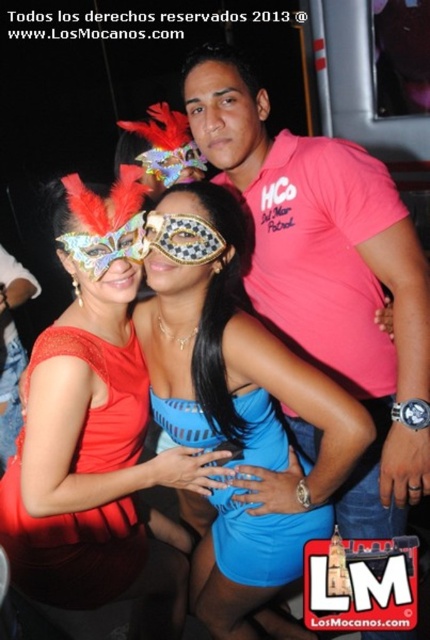
Question: Which of these objects is positioned closest to the blue jersey at center?

Choices:
 (A) shiny blue dress at center
 (B) red satin dress at center

Answer: (A)

Question: Is blue satin dress at center behind red satin dress at center?

Choices:
 (A) no
 (B) yes

Answer: (A)

Question: Among these points, which one is farthest from the camera?

Choices:
 (A) (126, 401)
 (B) (239, 321)
 (C) (168, 580)

Answer: (C)

Question: Which of the following is the closest to the observer?

Choices:
 (A) blue satin dress at center
 (B) blue jersey at center
 (C) red satin dress at center

Answer: (A)

Question: Can you confirm if shiny blue dress at center is positioned to the right of red satin dress at center?

Choices:
 (A) no
 (B) yes

Answer: (B)

Question: Does blue satin dress at center appear under red satin dress at center?

Choices:
 (A) no
 (B) yes

Answer: (A)